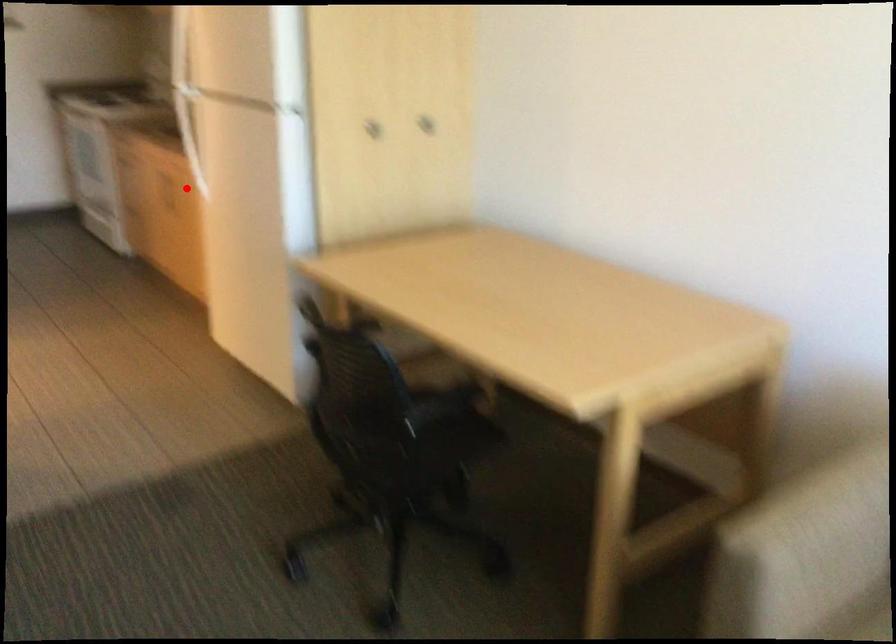
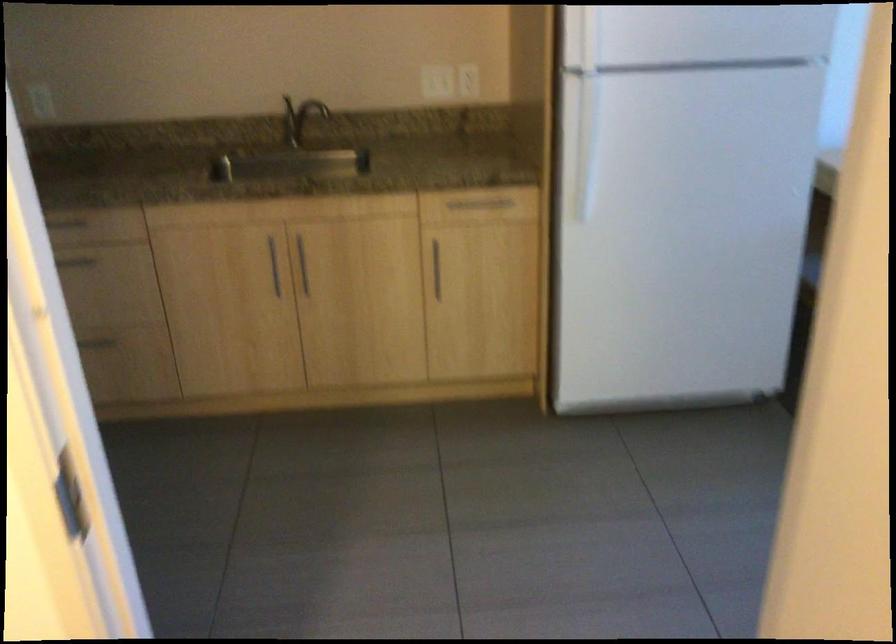
Find the pixel in the second image that matches the highlighted location in the first image.

(273, 265)